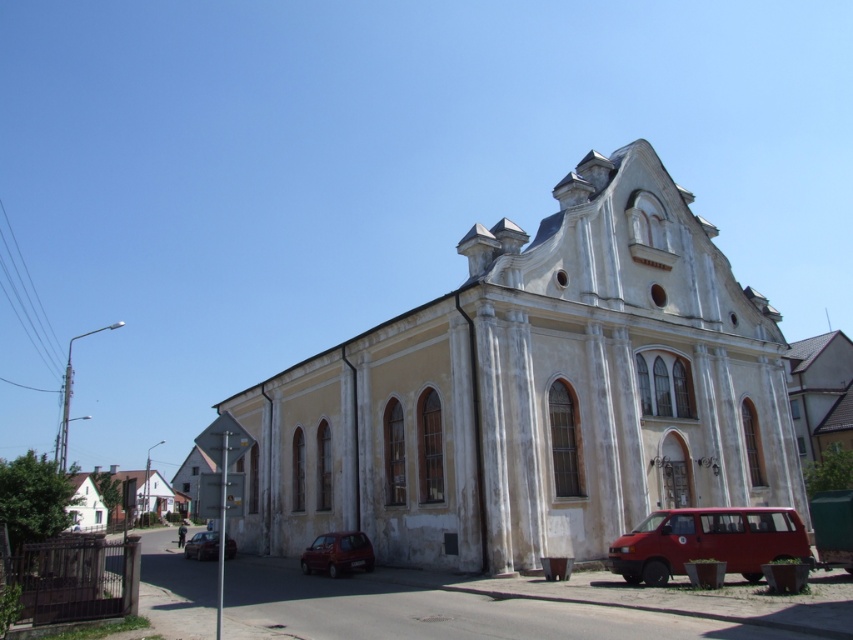
Question: Which object appears farthest from the camera in this image?

Choices:
 (A) matte red car at lower left
 (B) matte red car at lower center
 (C) white stone church at center
 (D) matte red van at lower right

Answer: (A)

Question: Is white stone church at center to the right of matte red van at lower right from the viewer's perspective?

Choices:
 (A) no
 (B) yes

Answer: (A)

Question: Can you confirm if matte red car at lower center is thinner than matte red car at lower left?

Choices:
 (A) yes
 (B) no

Answer: (A)

Question: Considering the real-world distances, which object is farthest from the white stone church at center?

Choices:
 (A) matte red car at lower center
 (B) matte red car at lower left

Answer: (B)

Question: Which of the following is the farthest from the observer?

Choices:
 (A) (733, 560)
 (B) (231, 541)
 (C) (361, 557)
 (D) (544, 257)

Answer: (B)

Question: Can you confirm if matte red van at lower right is positioned above matte red car at lower left?

Choices:
 (A) no
 (B) yes

Answer: (B)